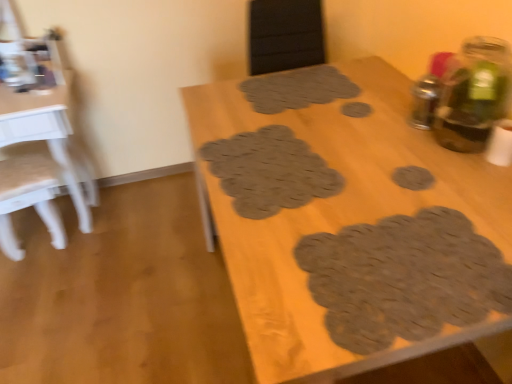
Where is `vacant space that's between brown textured mat at bottom right, arranged as the first footprint when ordered from the bottom, and brown felt coaster at center, which is counted as the 2th footprint, starting from the back`? vacant space that's between brown textured mat at bottom right, arranged as the first footprint when ordered from the bottom, and brown felt coaster at center, which is counted as the 2th footprint, starting from the back is located at coordinates (373, 172).